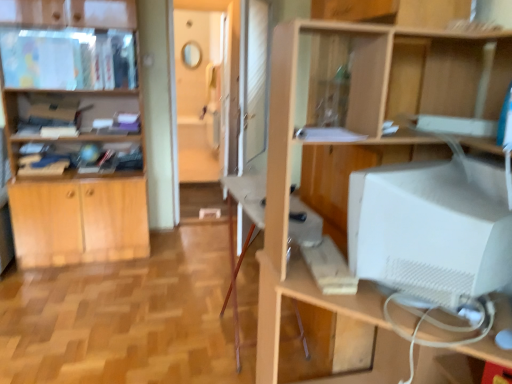
Based on the photo, measure the distance between point (93, 52) and camera.

Point (93, 52) is 2.97 meters away from camera.

What is the approximate width of wooden computer desk at center?

It is 38.06 centimeters.

Describe the element at coordinates (431, 229) in the screenshot. I see `white matte computer monitor at right` at that location.

Locate an element on the screen. Image resolution: width=512 pixels, height=384 pixels. white matte computer tower at right is located at coordinates (354, 148).

The image size is (512, 384). In order to click on light wood cabinet at left in this screenshot , I will do `click(73, 131)`.

Does white matte computer tower at right come in front of wooden computer desk at center?

Yes, white matte computer tower at right is closer to the viewer.

How distant is white matte computer tower at right from wooden computer desk at center?

A distance of 45.16 centimeters exists between white matte computer tower at right and wooden computer desk at center.

From a real-world perspective, between white matte computer tower at right and wooden computer desk at center, who is vertically higher?

white matte computer tower at right, from a real-world perspective.

Can you see wooden computer desk at center touching white matte computer tower at right?

No, wooden computer desk at center is not with white matte computer tower at right.

From the image's perspective, would you say wooden computer desk at center is positioned over white matte computer tower at right?

No, from the image's perspective, wooden computer desk at center is not above white matte computer tower at right.

Is wooden computer desk at center inside or outside of white matte computer tower at right?

wooden computer desk at center is not enclosed by white matte computer tower at right.

Considering the relative sizes of wooden computer desk at center and white matte computer tower at right in the image provided, is wooden computer desk at center taller than white matte computer tower at right?

No, wooden computer desk at center is not taller than white matte computer tower at right.

Is white matte computer monitor at right positioned far away from wooden computer desk at center?

white matte computer monitor at right is near wooden computer desk at center, not far away.

Considering the sizes of white matte computer monitor at right and wooden computer desk at center in the image, is white matte computer monitor at right wider or thinner than wooden computer desk at center?

white matte computer monitor at right is wider than wooden computer desk at center.

Considering the points (407, 230) and (306, 228), which point is behind, point (407, 230) or point (306, 228)?

Positioned behind is point (306, 228).

From a real-world perspective, is white matte computer monitor at right positioned above or below wooden computer desk at center?

white matte computer monitor at right is above wooden computer desk at center.

From their relative heights in the image, would you say light wood cabinet at left is taller or shorter than white matte computer tower at right?

light wood cabinet at left is taller than white matte computer tower at right.

Is light wood cabinet at left inside or outside of white matte computer tower at right?

light wood cabinet at left is not enclosed by white matte computer tower at right.

Considering the sizes of light wood cabinet at left and white matte computer tower at right in the image, is light wood cabinet at left wider or thinner than white matte computer tower at right?

Clearly, light wood cabinet at left has less width compared to white matte computer tower at right.

From the image's perspective, is light wood cabinet at left located beneath white matte computer tower at right?

No.

Is white matte computer monitor at right inside light wood cabinet at left?

No, light wood cabinet at left does not contain white matte computer monitor at right.

Is light wood cabinet at left placed right next to white matte computer monitor at right?

No, light wood cabinet at left is not beside white matte computer monitor at right.

From the image's perspective, which one is positioned lower, light wood cabinet at left or white matte computer monitor at right?

white matte computer monitor at right, from the image's perspective.

Is light wood cabinet at left to the left of white matte computer monitor at right from the viewer's perspective?

Correct, you'll find light wood cabinet at left to the left of white matte computer monitor at right.

Considering the sizes of objects matte wooden cabinet at upper left and wooden computer desk at center in the image provided, who is shorter, matte wooden cabinet at upper left or wooden computer desk at center?

matte wooden cabinet at upper left.

Is matte wooden cabinet at upper left further to the viewer compared to wooden computer desk at center?

Yes, it is behind wooden computer desk at center.

Can you confirm if matte wooden cabinet at upper left is wider than wooden computer desk at center?

Correct, the width of matte wooden cabinet at upper left exceeds that of wooden computer desk at center.

Which is more to the right, wooden computer desk at center or light wood cabinet at left?

Positioned to the right is wooden computer desk at center.

Between wooden computer desk at center and light wood cabinet at left, which one has more height?

With more height is light wood cabinet at left.

Is wooden computer desk at center in front of or behind light wood cabinet at left in the image?

wooden computer desk at center is positioned closer to the viewer than light wood cabinet at left.

This screenshot has height=384, width=512. What are the coordinates of `computer desk beneath the light wood cabinet at left (from a real-world perspective)` in the screenshot? It's located at (246, 212).

The width and height of the screenshot is (512, 384). I want to click on computer desk below the white matte computer tower at right (from a real-world perspective), so click(x=246, y=212).

There is a wooden computer desk at center. Where is `shelf above it (from a real-world perspective)`? Image resolution: width=512 pixels, height=384 pixels. shelf above it (from a real-world perspective) is located at coordinates (354, 148).

When comparing their distances from light wood cabinet at left, does matte wooden cabinet at upper left or white matte computer tower at right seem closer?

matte wooden cabinet at upper left lies closer to light wood cabinet at left than the other object.

Looking at the image, which one is located further to wooden computer desk at center, matte wooden cabinet at upper left or light wood cabinet at left?

matte wooden cabinet at upper left is positioned further to the anchor wooden computer desk at center.

When comparing their distances from light wood cabinet at left, does white matte computer monitor at right or wooden computer desk at center seem closer?

Among the two, wooden computer desk at center is located nearer to light wood cabinet at left.

Considering their positions, is white matte computer monitor at right positioned closer to white matte computer tower at right than light wood cabinet at left?

white matte computer monitor at right.

Estimate the real-world distances between objects in this image. Which object is closer to white matte computer tower at right, white matte computer monitor at right or matte wooden cabinet at upper left?

white matte computer monitor at right lies closer to white matte computer tower at right than the other object.

Based on their spatial positions, is light wood cabinet at left or matte wooden cabinet at upper left closer to white matte computer tower at right?

light wood cabinet at left.

Looking at the image, which one is located closer to matte wooden cabinet at upper left, white matte computer monitor at right or white matte computer tower at right?

white matte computer tower at right is closer to matte wooden cabinet at upper left.

Considering their positions, is matte wooden cabinet at upper left positioned closer to white matte computer monitor at right than white matte computer tower at right?

Among the two, white matte computer tower at right is located nearer to white matte computer monitor at right.

Identify the location of computer monitor between white matte computer tower at right and wooden computer desk at center in the front-back direction. Image resolution: width=512 pixels, height=384 pixels. (431, 229).

The width and height of the screenshot is (512, 384). What are the coordinates of `computer desk between light wood cabinet at left and white matte computer monitor at right from left to right` in the screenshot? It's located at (246, 212).

I want to click on computer monitor situated between light wood cabinet at left and white matte computer tower at right from left to right, so click(431, 229).

Locate an element on the screen. This screenshot has height=384, width=512. computer desk between matte wooden cabinet at upper left and white matte computer tower at right from left to right is located at coordinates (246, 212).